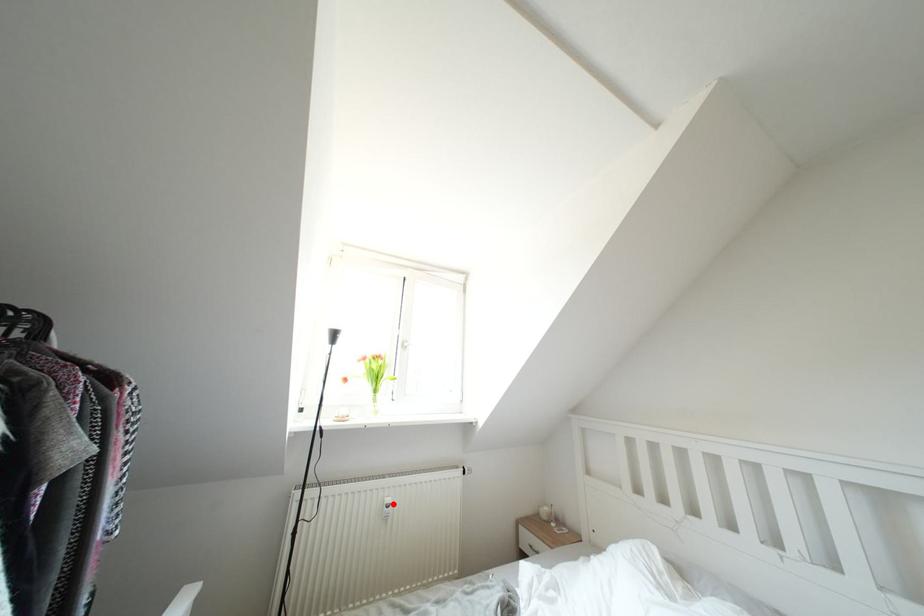
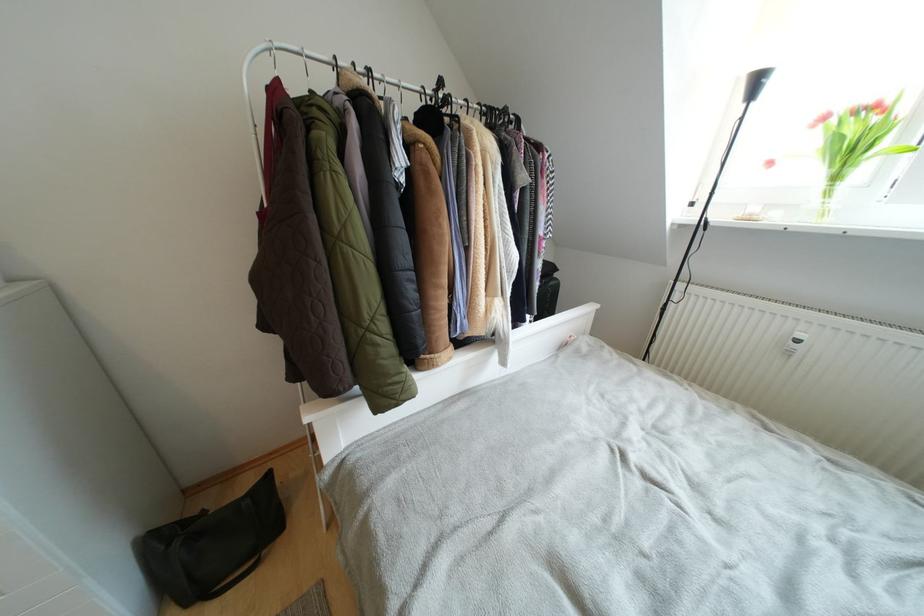
Where in the second image is the point corresponding to the highlighted location from the first image?

(805, 339)